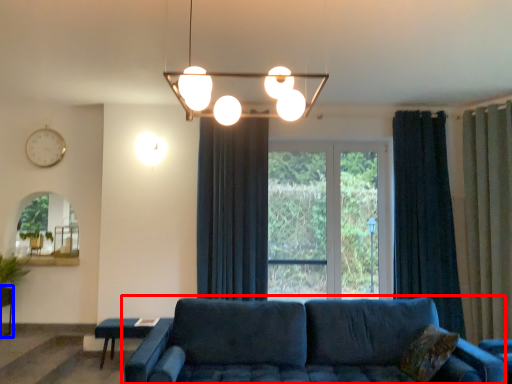
Question: Which point is closer to the camera, studio couch (highlighted by a red box) or table (highlighted by a blue box)?

Choices:
 (A) studio couch
 (B) table

Answer: (A)